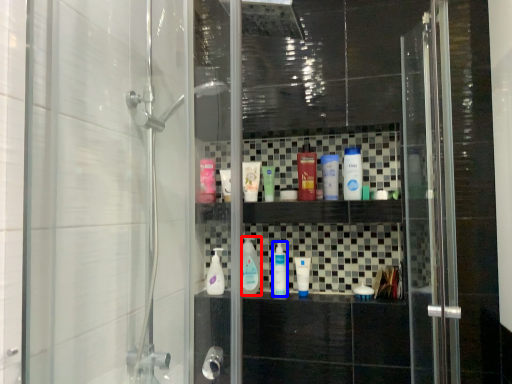
Question: Among these objects, which one is farthest to the camera, mouthwash (highlighted by a red box) or mouthwash (highlighted by a blue box)?

Choices:
 (A) mouthwash
 (B) mouthwash

Answer: (A)